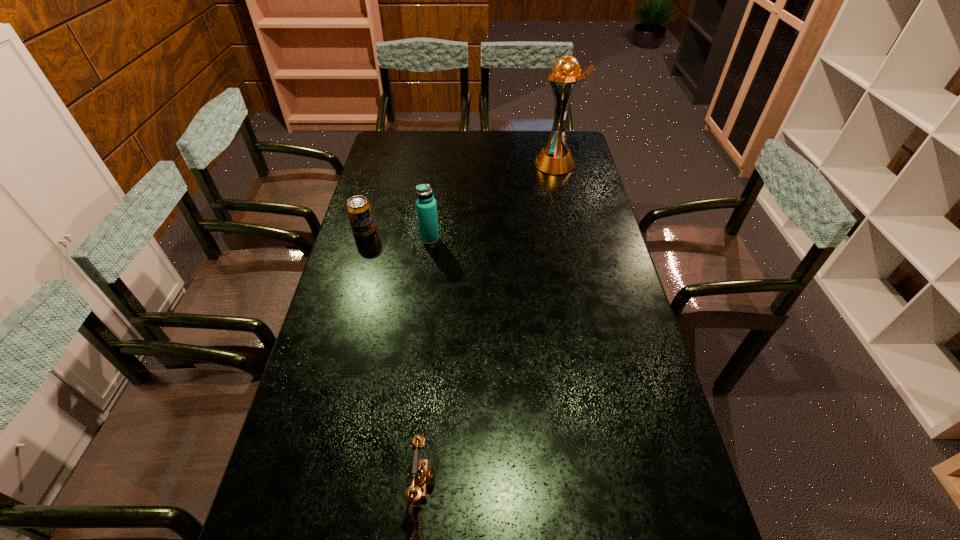
I want to click on object that is at the left edge, so click(x=358, y=208).

Locate an element on the screen. The image size is (960, 540). object at the right edge is located at coordinates (555, 158).

Locate an element on the screen. This screenshot has height=540, width=960. object that is at the far right corner is located at coordinates (555, 158).

The width and height of the screenshot is (960, 540). In order to click on free region at the far edge of the desktop in this screenshot , I will do `click(482, 132)`.

In the image, there is a desktop. Find the location of `free region at the left edge`. free region at the left edge is located at coordinates coord(352,301).

Find the location of a particular element. The height and width of the screenshot is (540, 960). blank space at the right edge is located at coordinates (577, 274).

In order to click on empty space that is in between the rightmost object and the soda can in this screenshot , I will do `click(460, 198)`.

You are a GUI agent. You are given a task and a screenshot of the screen. Output one action in this format:
    pyautogui.click(x=<x>, y=<y>)
    Task: Click on the free spot between the farthest object and the second tallest object
    The height and width of the screenshot is (540, 960).
    Given the screenshot: What is the action you would take?
    point(492,201)

Identify the location of free area in between the second tallest object and the soda can. This screenshot has height=540, width=960. (397, 235).

Image resolution: width=960 pixels, height=540 pixels. I want to click on object that stands as the second closest to the soda can, so click(555, 158).